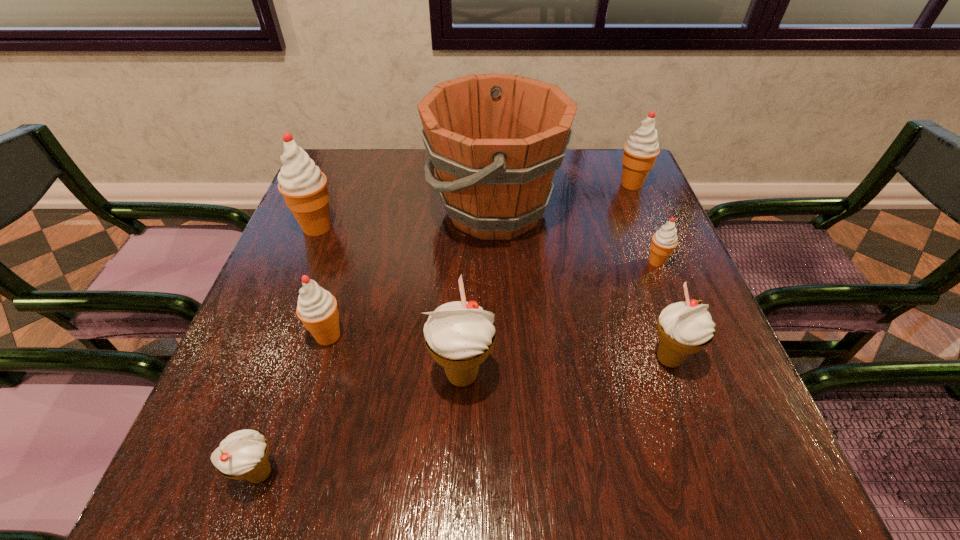
You are a GUI agent. You are given a task and a screenshot of the screen. Output one action in this format:
    pyautogui.click(x=<x>, y=<y>)
    Task: Click on the object that is the closest one to the second white icecream from right to left
    This screenshot has width=960, height=540.
    Given the screenshot: What is the action you would take?
    pyautogui.click(x=317, y=308)

Choose which icecream is the fourth nearest neighbor to the fourth icecream from right to left. Please provide its 2D coordinates. Your answer should be formatted as a tuple, i.e. [(x, y)], where the tuple contains the x and y coordinates of a point satisfying the conditions above.

[(304, 187)]

Where is `icecream that stands as the fourth closest to the rightmost white icecream`? This screenshot has height=540, width=960. icecream that stands as the fourth closest to the rightmost white icecream is located at coordinates (317, 308).

The height and width of the screenshot is (540, 960). Identify the location of the second closest red icecream relative to the third red icecream from right to left. (664, 241).

Locate which red icecream is the fourth closest to the leftmost white icecream. Please provide its 2D coordinates. Your answer should be formatted as a tuple, i.e. [(x, y)], where the tuple contains the x and y coordinates of a point satisfying the conditions above.

[(640, 151)]

Point out which white icecream is positioned as the third nearest to the bucket. Please provide its 2D coordinates. Your answer should be formatted as a tuple, i.e. [(x, y)], where the tuple contains the x and y coordinates of a point satisfying the conditions above.

[(243, 454)]

Find the location of a particular element. The width and height of the screenshot is (960, 540). white icecream identified as the closest to the bucket is located at coordinates (684, 328).

Find the location of a particular element. vacant space that satisfies the following two spatial constraints: 1. on the back side of the second nearest red icecream; 2. on the right side of the rightmost white icecream is located at coordinates (635, 261).

Where is `free space that satisfies the following two spatial constraints: 1. on the handle side of the bucket; 2. on the front side of the second smallest red icecream`? free space that satisfies the following two spatial constraints: 1. on the handle side of the bucket; 2. on the front side of the second smallest red icecream is located at coordinates (499, 336).

You are a GUI agent. You are given a task and a screenshot of the screen. Output one action in this format:
    pyautogui.click(x=<x>, y=<y>)
    Task: Click on the free region that satisfies the following two spatial constraints: 1. on the back side of the smallest red icecream; 2. on the handle side of the bucket
    The image size is (960, 540).
    Given the screenshot: What is the action you would take?
    pyautogui.click(x=636, y=210)